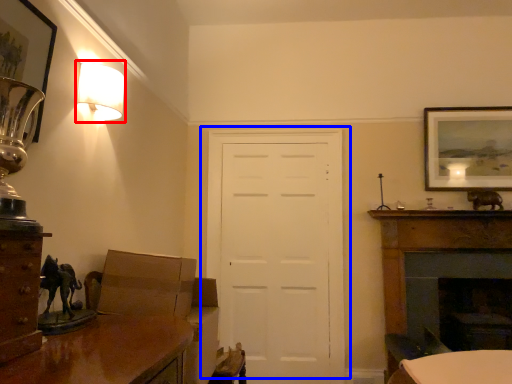
Question: Among these objects, which one is farthest to the camera, lamp (highlighted by a red box) or door (highlighted by a blue box)?

Choices:
 (A) lamp
 (B) door

Answer: (B)